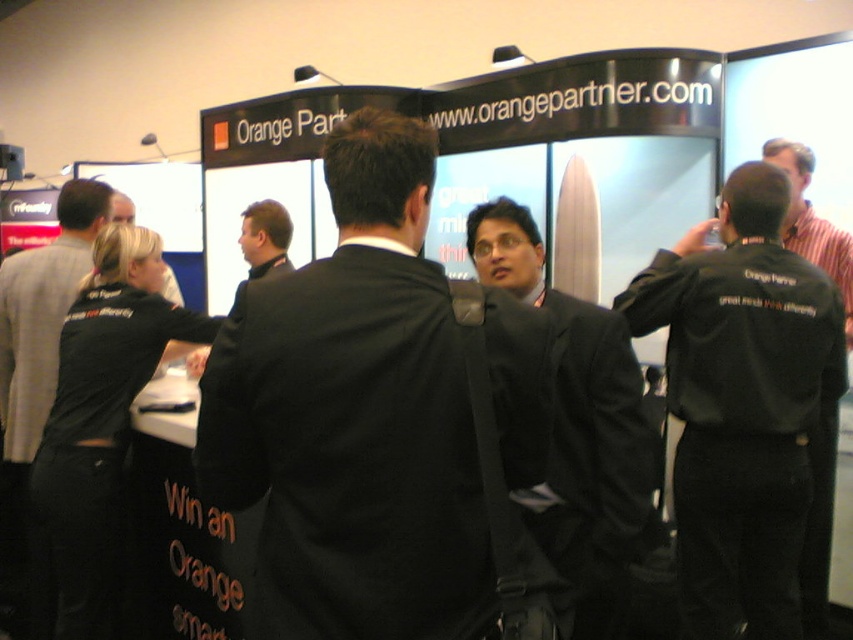
You are attending a trade show and notice two people in suits at the Orange Partner booth. One is wearing a black fabric suit at center and the other a matte black suit at center. From your perspective, which suit is located to the left?

The black fabric suit at center is positioned on the left side of matte black suit at center, so the black fabric suit at center is on the left.

You are attending a trade show and want to approach the Orange Partner booth. You notice two people in black clothing. One is wearing a matte black suit at center and another is wearing a black fabric shirt at left. Which person is standing in front of the other?

The matte black suit at center is positioned over the black fabric shirt at left, meaning the person in the matte black suit at center is standing in front of the person in the black fabric shirt at left.

You are standing at the trade show booth and want to take a photo of the point at coordinate (286, 472). If your camera has a focal length of 50mm and you are currently 1.17 meters away from the point, will you need to move closer or farther to ensure the point fills the frame properly?

A: The distance of point (286, 472) from camera is 1.17 meters. To fill the frame properly, you should move closer if the subject is too small or farther if it is too large, but since the exact required distance isn not provided, you can adjust based on preview.